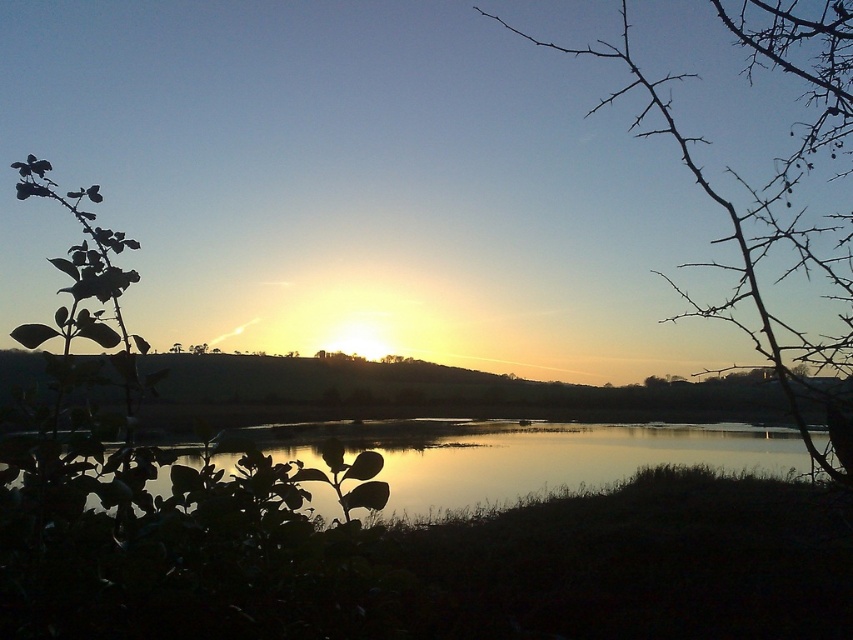
You are an artist trying to paint the sunset scene. You want to ensure the bare branches at right and the silvery reflective water at center are proportionally accurate. Which object should you paint smaller in your artwork?

The bare branches at right should be painted smaller than the silvery reflective water at center because the bare branches at right has a smaller size compared to silvery reflective water at center.

You are an artist trying to paint the sunset scene. You want to ensure the bare branches at right are visible against the silvery reflective water at center. Based on their positions, will the branches block the view of the water below them?

The bare branches at right is positioned over silvery reflective water at center, so yes, the branches will block the view of the water below them.

You are a bird flying over the serene sunset scene. You want to land on the closest object between the bare branches at right and the silvery reflective water at center. Which object should you choose?

The bare branches at right and silvery reflective water at center are 8.44 feet apart. Since the question asks for the closest object to land on, you need to choose the one that is nearer to your current position. However, without knowing your exact location, it is impossible to determine which is closer. Please provide your current position relative to these objects.